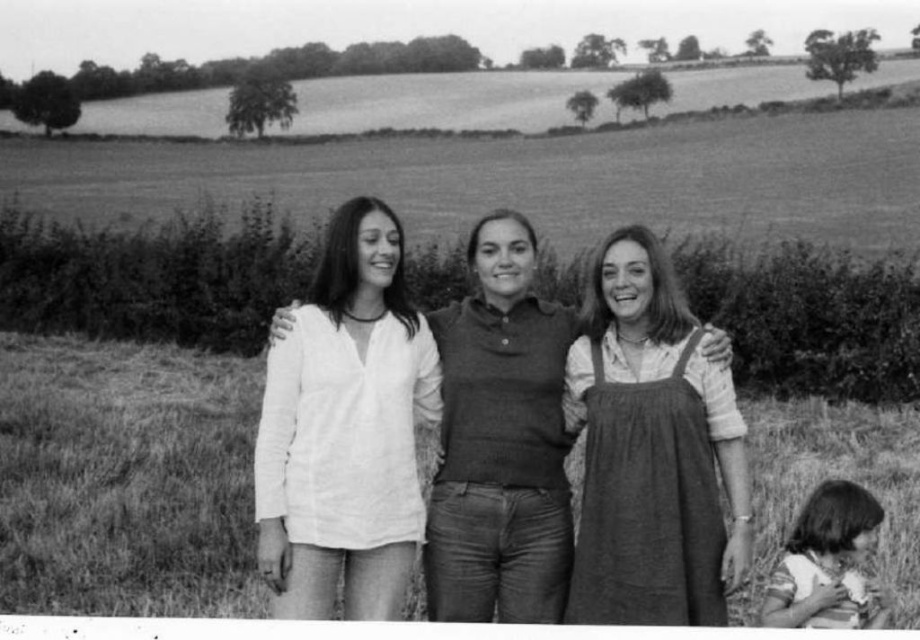
You are a photographer trying to capture a group photo of the dungaree dress at center and the striped cotton shirt at lower right. Based on their positions, which clothing item is higher in the image?

The dungaree dress at center is located above the striped cotton shirt at lower right, so the dungaree dress at center is higher in the image.